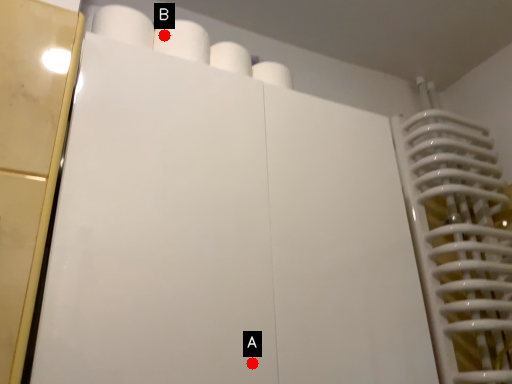
Question: Two points are circled on the image, labeled by A and B beside each circle. Which point is further to the camera?

Choices:
 (A) A is further
 (B) B is further

Answer: (B)